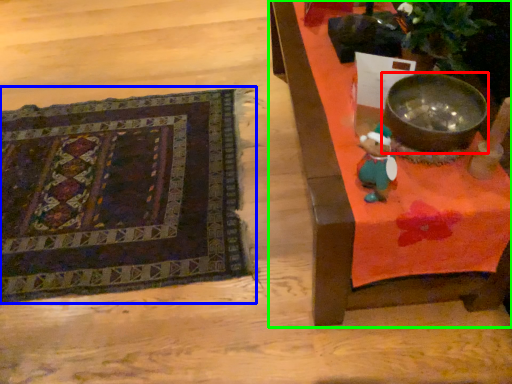
Question: Estimate the real-world distances between objects in this image. Which object is closer to mixing bowl (highlighted by a red box), mat (highlighted by a blue box) or furniture (highlighted by a green box)?

Choices:
 (A) mat
 (B) furniture

Answer: (B)